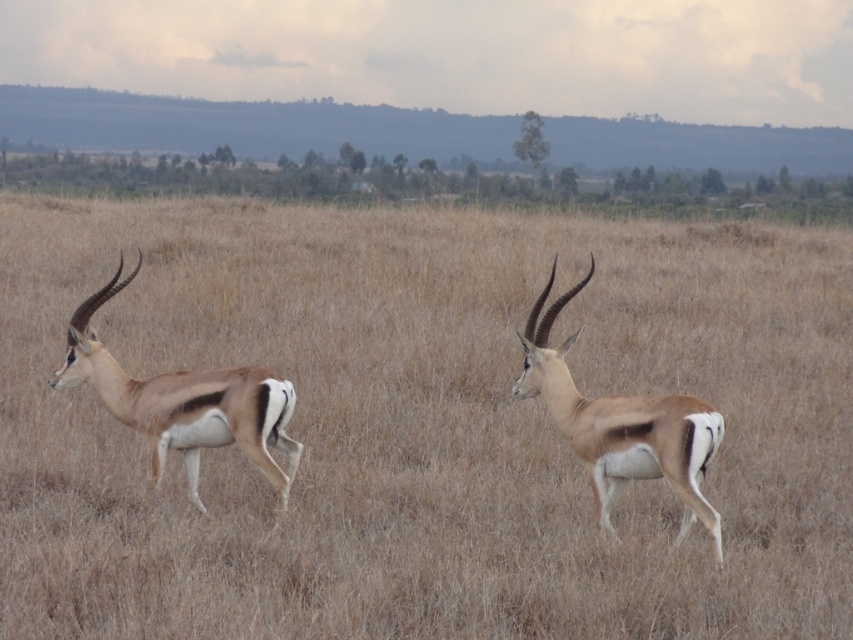
From the picture: You are a wildlife photographer trying to capture a closeup shot of two brown smooth antelope at left. You have a camera with a 100mm lens that can focus on subjects within 15 feet. Can you get a clear photo of both antelope without moving closer?

The two brown smooth antelope at left are 16.46 feet apart, which is beyond the 15 feet focusing range of your 100mm lens. Therefore, you cannot get a clear photo of both antelope without moving closer.

You are a wildlife photographer trying to capture both the brown smooth antelope at left and the brown matte deer at center in a single frame. Which animal should you focus on first if you want to ensure both are in focus, considering their sizes?

The brown smooth antelope at left is bigger than the brown matte deer at center, so focusing on the larger brown smooth antelope at left first would help ensure both are in focus as it requires a closer focus distance.